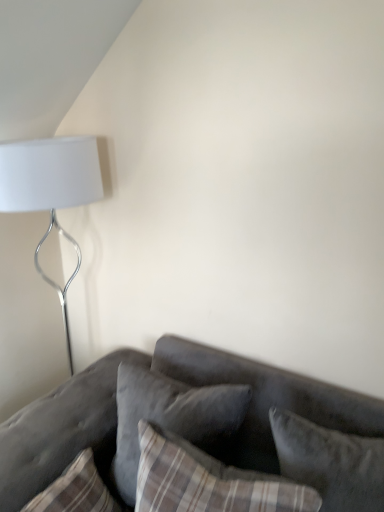
Where is `white matte lamp at upper left`? white matte lamp at upper left is located at coordinates (54, 188).

What do you see at coordinates (169, 416) in the screenshot?
I see `velvet gray pillow at center, marked as the second pillow in a left-to-right arrangement` at bounding box center [169, 416].

How much space does velvet gray pillow at center, arranged as the 2th pillow when viewed from the right, occupy horizontally?

velvet gray pillow at center, arranged as the 2th pillow when viewed from the right, is 13.21 inches wide.

The height and width of the screenshot is (512, 384). I want to click on velvet gray pillow at lower right, acting as the first pillow starting from the right, so click(x=330, y=462).

What do you see at coordinates (200, 429) in the screenshot? The image size is (384, 512). I see `velvet gray couch at lower right` at bounding box center [200, 429].

You are a GUI agent. You are given a task and a screenshot of the screen. Output one action in this format:
    pyautogui.click(x=<x>, y=<y>)
    Task: Click on the white matte lamp at upper left
    
    Given the screenshot: What is the action you would take?
    pyautogui.click(x=54, y=188)

Is white matte lamp at upper left shorter than velvet gray pillow at lower right, the third pillow viewed from the left?

No, white matte lamp at upper left is not shorter than velvet gray pillow at lower right, the third pillow viewed from the left.

Can you confirm if white matte lamp at upper left is wider than velvet gray pillow at lower right, acting as the first pillow starting from the right?

Correct, the width of white matte lamp at upper left exceeds that of velvet gray pillow at lower right, acting as the first pillow starting from the right.

Is white matte lamp at upper left positioned with its back to velvet gray pillow at lower right, acting as the first pillow starting from the right?

No, white matte lamp at upper left is not facing away from velvet gray pillow at lower right, acting as the first pillow starting from the right.

Is white matte lamp at upper left situated inside velvet gray pillow at lower right, acting as the first pillow starting from the right, or outside?

The correct answer is: outside.

From a real-world perspective, is velvet gray pillow at center, marked as the second pillow in a left-to-right arrangement, located higher than velvet gray couch at lower right?

Yes.

Does velvet gray pillow at center, marked as the second pillow in a left-to-right arrangement, turn towards velvet gray couch at lower right?

Yes, velvet gray pillow at center, marked as the second pillow in a left-to-right arrangement, is facing velvet gray couch at lower right.

Where is `studio couch beneath the velvet gray pillow at center, arranged as the 2th pillow when viewed from the right (from a real-world perspective)`? The height and width of the screenshot is (512, 384). studio couch beneath the velvet gray pillow at center, arranged as the 2th pillow when viewed from the right (from a real-world perspective) is located at coordinates (200, 429).

Is white matte lamp at upper left positioned beyond the bounds of velvet gray couch at lower right?

That's correct, white matte lamp at upper left is outside of velvet gray couch at lower right.

Looking at this image, from a real-world perspective, which object stands above the other?

white matte lamp at upper left is physically above.

Is point (94, 179) more distant than point (172, 392)?

That is True.

How much distance is there between white matte lamp at upper left and velvet gray couch at lower right?

white matte lamp at upper left is 33.39 inches away from velvet gray couch at lower right.

Looking at this image, considering the relative sizes of white matte lamp at upper left and plaid fabric pillow at lower left, which is the first pillow from left to right, in the image provided, is white matte lamp at upper left wider than plaid fabric pillow at lower left, which is the first pillow from left to right,?

Yes, white matte lamp at upper left is wider than plaid fabric pillow at lower left, which is the first pillow from left to right.

Which is further, (39, 183) or (60, 416)?

The point (60, 416) is farther from the camera.

Identify the location of the 3rd pillow positioned below the white matte lamp at upper left (from a real-world perspective). (62, 430).

Is white matte lamp at upper left aimed at plaid fabric pillow at lower left, which ranks as the third pillow in right-to-left order?

No, white matte lamp at upper left is not facing towards plaid fabric pillow at lower left, which ranks as the third pillow in right-to-left order.

Is velvet gray pillow at lower right, the third pillow viewed from the left, to the left of plaid fabric pillow at lower left, which is the first pillow from left to right, from the viewer's perspective?

In fact, velvet gray pillow at lower right, the third pillow viewed from the left, is to the right of plaid fabric pillow at lower left, which is the first pillow from left to right.

Which object is closer to the camera, velvet gray pillow at lower right, the third pillow viewed from the left, or plaid fabric pillow at lower left, which is the first pillow from left to right?

velvet gray pillow at lower right, the third pillow viewed from the left, is more forward.

Is velvet gray pillow at lower right, acting as the first pillow starting from the right, positioned far away from plaid fabric pillow at lower left, which is the first pillow from left to right?

No, velvet gray pillow at lower right, acting as the first pillow starting from the right, is not far from plaid fabric pillow at lower left, which is the first pillow from left to right.

Does point (376, 508) lie behind point (50, 416)?

No, (376, 508) is closer to viewer.

Is velvet gray couch at lower right taller or shorter than velvet gray pillow at lower right, acting as the first pillow starting from the right?

Clearly, velvet gray couch at lower right is taller compared to velvet gray pillow at lower right, acting as the first pillow starting from the right.

Is velvet gray couch at lower right with velvet gray pillow at lower right, acting as the first pillow starting from the right?

They are not placed beside each other.

Is velvet gray pillow at lower right, the third pillow viewed from the left, at the back of velvet gray couch at lower right?

Correct, velvet gray couch at lower right is looking away from velvet gray pillow at lower right, the third pillow viewed from the left.

From a real-world perspective, is velvet gray couch at lower right located beneath velvet gray pillow at lower right, acting as the first pillow starting from the right?

Yes, from a real-world perspective, velvet gray couch at lower right is beneath velvet gray pillow at lower right, acting as the first pillow starting from the right.

Would you say velvet gray pillow at center, arranged as the 2th pillow when viewed from the right, is outside plaid fabric pillow at lower left, which is the first pillow from left to right?

Yes.

Is velvet gray pillow at center, arranged as the 2th pillow when viewed from the right, next to plaid fabric pillow at lower left, which ranks as the third pillow in right-to-left order?

No, velvet gray pillow at center, arranged as the 2th pillow when viewed from the right, is not making contact with plaid fabric pillow at lower left, which ranks as the third pillow in right-to-left order.

Image resolution: width=384 pixels, height=512 pixels. I want to click on the 2nd pillow above the plaid fabric pillow at lower left, which ranks as the third pillow in right-to-left order (from the image's perspective), so click(169, 416).

Between velvet gray pillow at center, arranged as the 2th pillow when viewed from the right, and plaid fabric pillow at lower left, which ranks as the third pillow in right-to-left order, which one has more height?

Standing taller between the two is velvet gray pillow at center, arranged as the 2th pillow when viewed from the right.

Identify the location of the 2nd pillow below the white matte lamp at upper left (from the image's perspective). The height and width of the screenshot is (512, 384). (330, 462).

From a real-world perspective, which pillow is the 2nd one above the velvet gray couch at lower right? Please provide its 2D coordinates.

[(169, 416)]

Based on their spatial positions, is velvet gray pillow at lower right, the third pillow viewed from the left, or plaid fabric pillow at lower left, which is the first pillow from left to right, closer to velvet gray pillow at center, arranged as the 2th pillow when viewed from the right?

The object closer to velvet gray pillow at center, arranged as the 2th pillow when viewed from the right, is plaid fabric pillow at lower left, which is the first pillow from left to right.

Which object lies nearer to the anchor point velvet gray pillow at lower right, the third pillow viewed from the left, plaid fabric pillow at lower left, which ranks as the third pillow in right-to-left order, or velvet gray pillow at center, marked as the second pillow in a left-to-right arrangement?

velvet gray pillow at center, marked as the second pillow in a left-to-right arrangement.

Estimate the real-world distances between objects in this image. Which object is further from white matte lamp at upper left, velvet gray pillow at center, arranged as the 2th pillow when viewed from the right, or velvet gray couch at lower right?

velvet gray couch at lower right lies further to white matte lamp at upper left than the other object.

From the image, which object appears to be farther from velvet gray pillow at center, arranged as the 2th pillow when viewed from the right, white matte lamp at upper left or velvet gray pillow at lower right, acting as the first pillow starting from the right?

→ The object further to velvet gray pillow at center, arranged as the 2th pillow when viewed from the right, is white matte lamp at upper left.

From the image, which object appears to be nearer to velvet gray pillow at center, arranged as the 2th pillow when viewed from the right, velvet gray pillow at lower right, acting as the first pillow starting from the right, or white matte lamp at upper left?

velvet gray pillow at lower right, acting as the first pillow starting from the right, is closer to velvet gray pillow at center, arranged as the 2th pillow when viewed from the right.

Based on their spatial positions, is velvet gray pillow at lower right, the third pillow viewed from the left, or velvet gray pillow at center, marked as the second pillow in a left-to-right arrangement, closer to white matte lamp at upper left?

velvet gray pillow at center, marked as the second pillow in a left-to-right arrangement, is positioned closer to the anchor white matte lamp at upper left.

Based on their spatial positions, is white matte lamp at upper left or plaid fabric pillow at lower left, which is the first pillow from left to right, further from velvet gray pillow at lower right, the third pillow viewed from the left?

white matte lamp at upper left lies further to velvet gray pillow at lower right, the third pillow viewed from the left, than the other object.

Estimate the real-world distances between objects in this image. Which object is further from plaid fabric pillow at lower left, which is the first pillow from left to right, velvet gray couch at lower right or white matte lamp at upper left?

Based on the image, white matte lamp at upper left appears to be further to plaid fabric pillow at lower left, which is the first pillow from left to right.

Image resolution: width=384 pixels, height=512 pixels. Find the location of `studio couch situated between white matte lamp at upper left and velvet gray pillow at lower right, the third pillow viewed from the left, from left to right`. studio couch situated between white matte lamp at upper left and velvet gray pillow at lower right, the third pillow viewed from the left, from left to right is located at coordinates click(x=200, y=429).

Where is `studio couch between plaid fabric pillow at lower left, which ranks as the third pillow in right-to-left order, and velvet gray pillow at lower right, the third pillow viewed from the left, in the horizontal direction`? This screenshot has width=384, height=512. studio couch between plaid fabric pillow at lower left, which ranks as the third pillow in right-to-left order, and velvet gray pillow at lower right, the third pillow viewed from the left, in the horizontal direction is located at coordinates 200,429.

Locate an element on the screen. Image resolution: width=384 pixels, height=512 pixels. pillow located between plaid fabric pillow at lower left, which is the first pillow from left to right, and velvet gray pillow at lower right, acting as the first pillow starting from the right, in the left-right direction is located at coordinates (169, 416).

What are the coordinates of `studio couch located between velvet gray pillow at center, arranged as the 2th pillow when viewed from the right, and velvet gray pillow at lower right, the third pillow viewed from the left, in the left-right direction` in the screenshot? It's located at (200, 429).